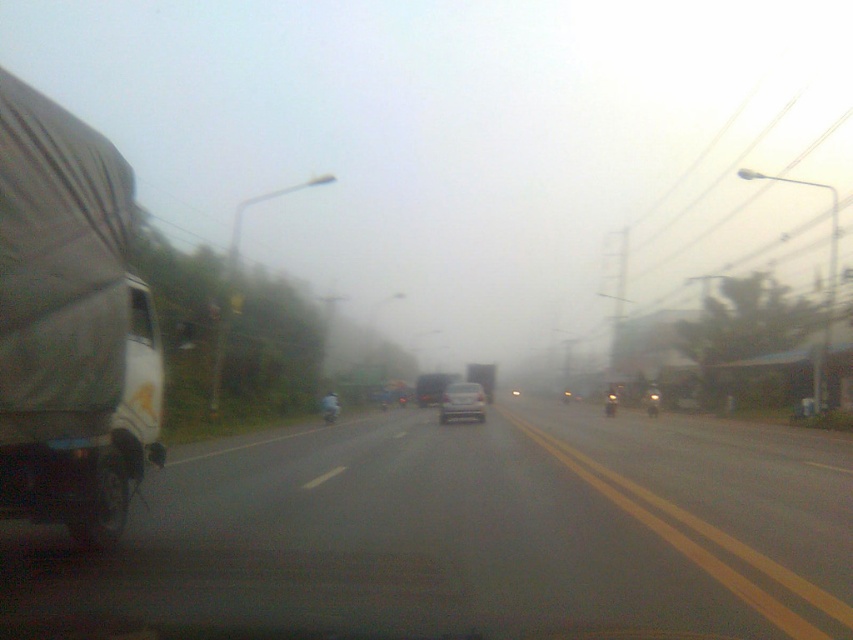
Question: Which point is farther from the camera taking this photo?

Choices:
 (A) (x=561, y=612)
 (B) (x=456, y=403)
 (C) (x=49, y=353)

Answer: (B)

Question: Is black matte truck at left closer to the viewer compared to white matte trailer truck at left?

Choices:
 (A) no
 (B) yes

Answer: (A)

Question: Estimate the real-world distances between objects in this image. Which object is closer to the silver metallic sedan at center?

Choices:
 (A) white matte trailer truck at left
 (B) black matte truck at left

Answer: (B)

Question: Which point is farther to the camera?

Choices:
 (A) white matte trailer truck at left
 (B) black matte truck at left
 (C) silver metallic sedan at center

Answer: (C)

Question: Is black matte truck at left positioned at the back of white matte trailer truck at left?

Choices:
 (A) yes
 (B) no

Answer: (A)

Question: Is black matte truck at left closer to camera compared to silver metallic sedan at center?

Choices:
 (A) no
 (B) yes

Answer: (B)